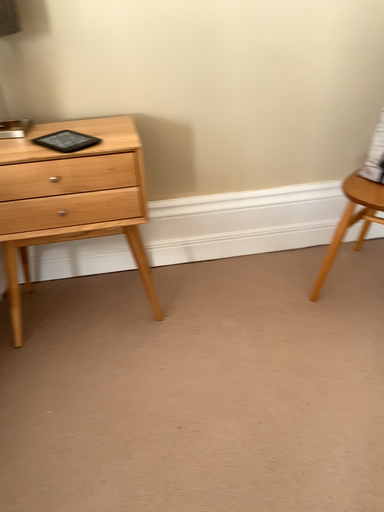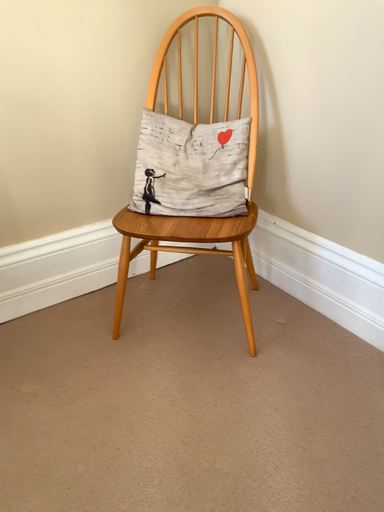
Question: How did the camera likely rotate when shooting the video?

Choices:
 (A) rotated right
 (B) rotated left

Answer: (A)